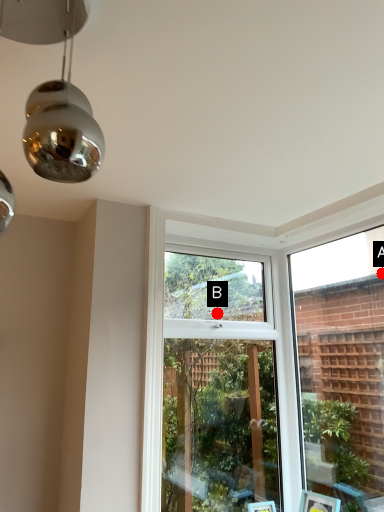
Question: Two points are circled on the image, labeled by A and B beside each circle. Which of the following is the closest to the observer?

Choices:
 (A) A is closer
 (B) B is closer

Answer: (A)